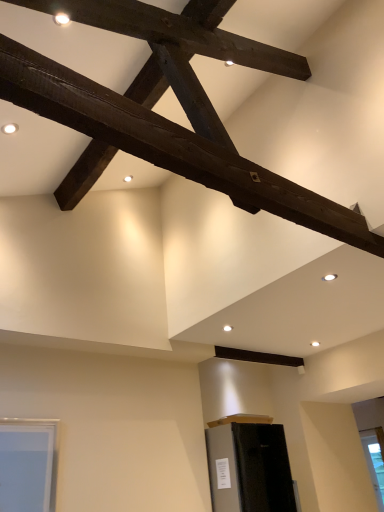
Question: Visually, is matte black refrigerator at lower center positioned to the left or to the right of clear glass window at lower right?

Choices:
 (A) left
 (B) right

Answer: (A)

Question: From the image's perspective, is matte black refrigerator at lower center located above or below clear glass window at lower right?

Choices:
 (A) above
 (B) below

Answer: (A)

Question: Which object is positioned farthest from the dark brown wood beam at upper center?

Choices:
 (A) clear glass window at lower right
 (B) matte black refrigerator at lower center

Answer: (A)

Question: Which of these objects is positioned farthest from the clear glass window at lower right?

Choices:
 (A) dark brown wood beam at upper center
 (B) matte black refrigerator at lower center

Answer: (A)